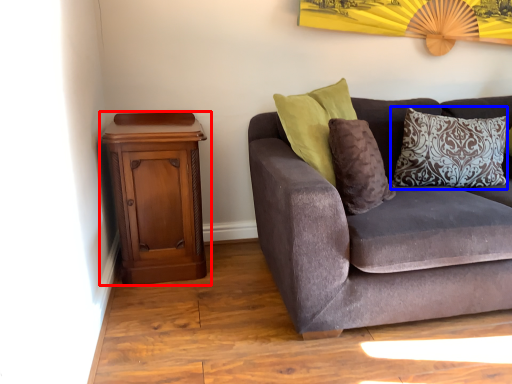
Question: Which point is closer to the camera, nightstand (highlighted by a red box) or pillow (highlighted by a blue box)?

Choices:
 (A) nightstand
 (B) pillow

Answer: (A)